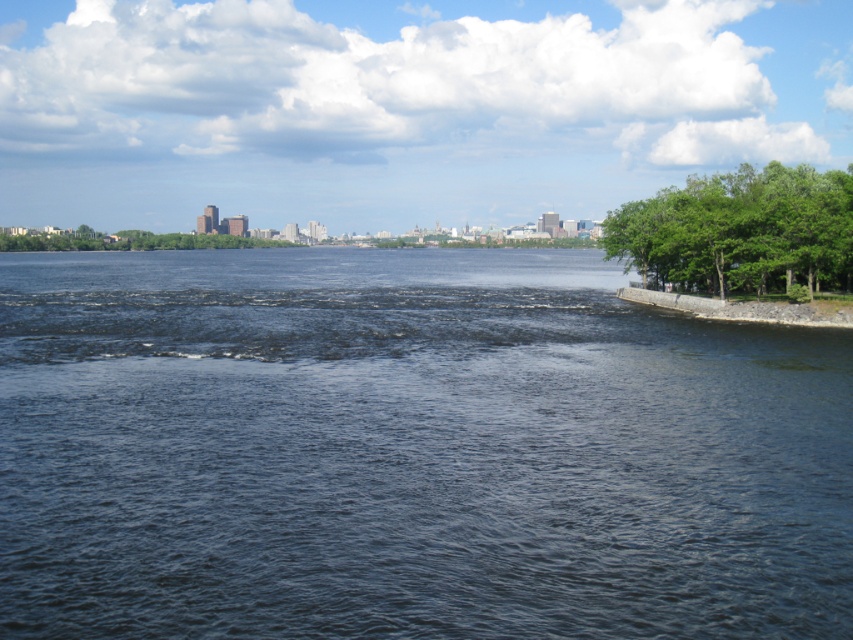
Is point (714, 593) behind point (33, 237)?

No, it is not.

Is point (91, 353) in front of point (103, 248)?

That is True.

Where is `dark blue water at center`? The height and width of the screenshot is (640, 853). dark blue water at center is located at coordinates (409, 451).

Locate an element on the screen. This screenshot has width=853, height=640. dark blue water at center is located at coordinates (409, 451).

Is smooth concrete wall at right above green leafy trees at center?

No, smooth concrete wall at right is not above green leafy trees at center.

Based on the photo, is smooth concrete wall at right smaller than green leafy trees at center?

Yes, smooth concrete wall at right is smaller than green leafy trees at center.

Between point (640, 300) and point (151, 236), which one is positioned in front?

Point (640, 300)

The height and width of the screenshot is (640, 853). Identify the location of smooth concrete wall at right. point(744,307).

Does dark blue water at center have a larger size compared to green leafy trees at right?

Actually, dark blue water at center might be smaller than green leafy trees at right.

Can you confirm if dark blue water at center is positioned below green leafy trees at right?

Indeed, dark blue water at center is positioned under green leafy trees at right.

Which is behind, point (68, 625) or point (708, 205)?

The point (708, 205) is behind.

The image size is (853, 640). What are the coordinates of `dark blue water at center` in the screenshot? It's located at (409, 451).